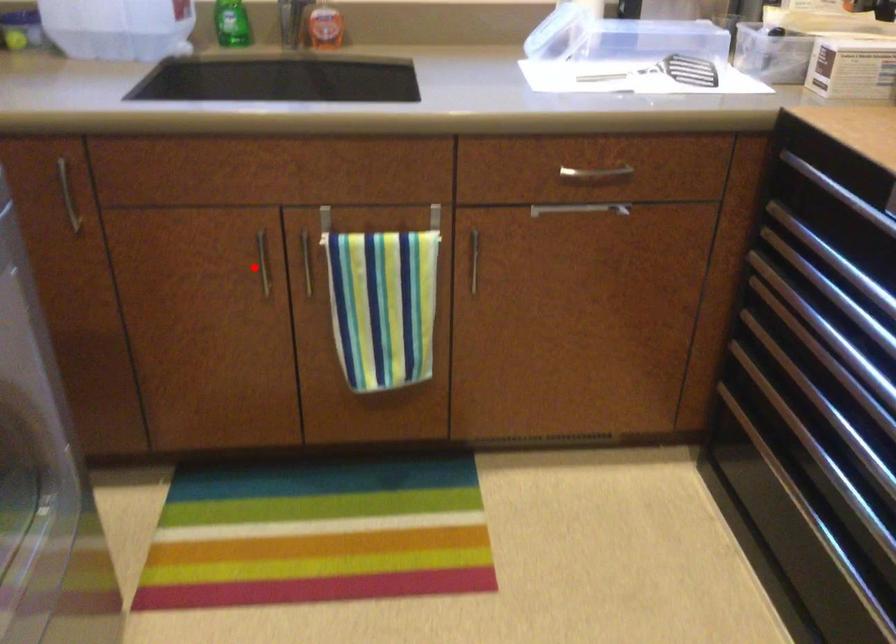
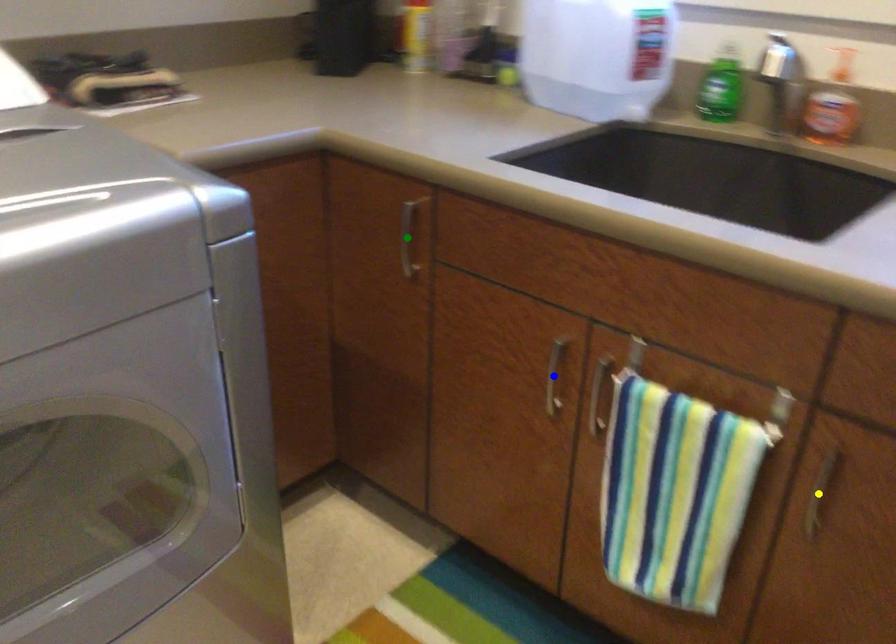
Question: I am providing you with two images of the same scene from different viewpoints. A red point is marked on the first image. You are given multiple points on the second image. Which mark in image 2 goes with the point in image 1?

Choices:
 (A) green point
 (B) yellow point
 (C) blue point

Answer: (C)